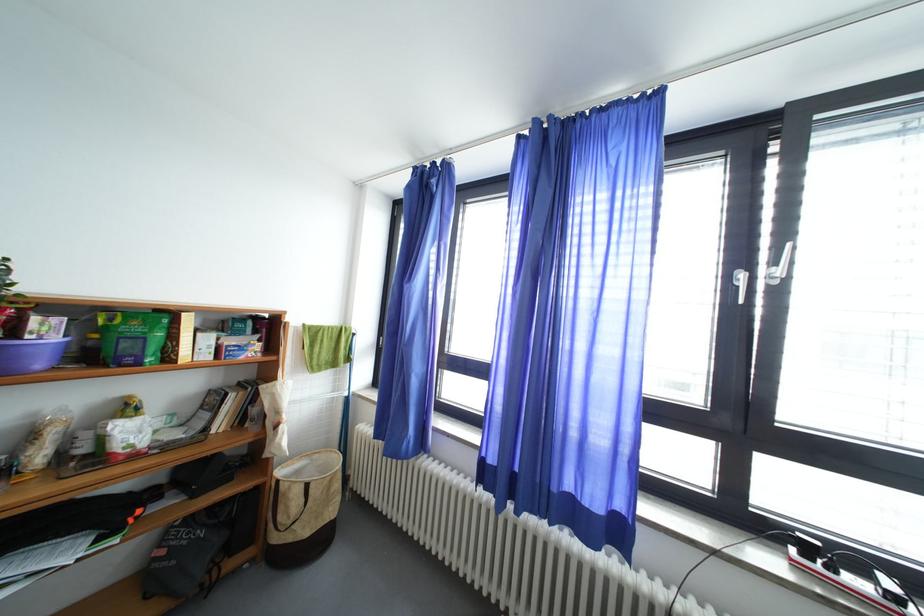
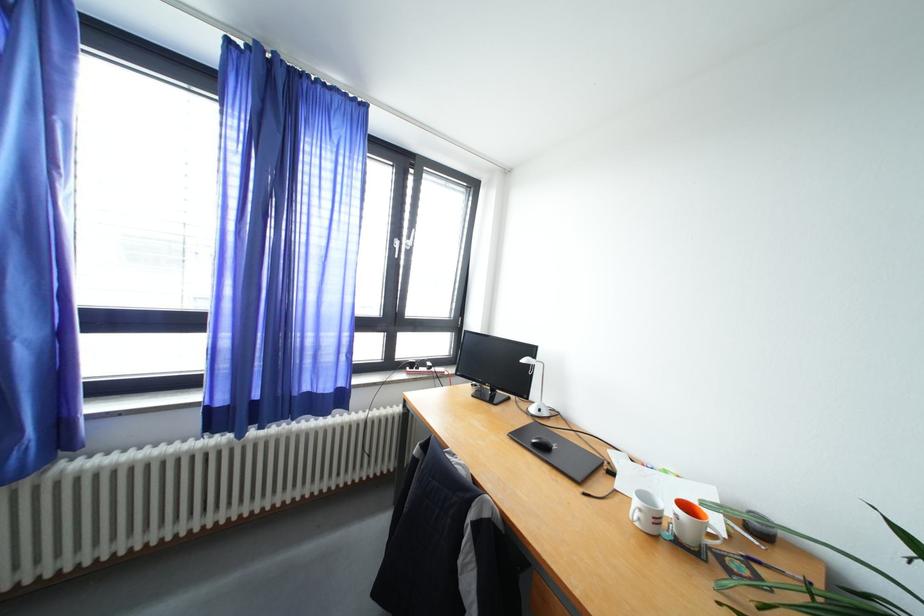
Find the pixel in the second image that matches pixel 813 553 in the first image.

(419, 370)